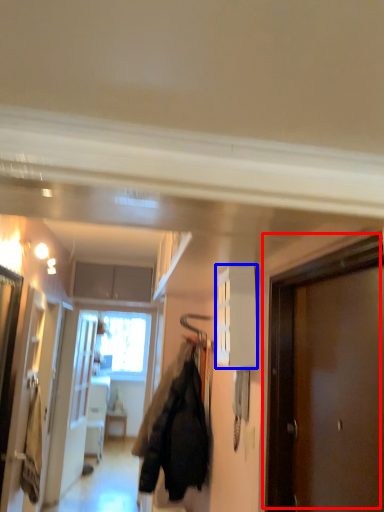
Question: Among these objects, which one is farthest to the camera, door (highlighted by a red box) or cabinetry (highlighted by a blue box)?

Choices:
 (A) door
 (B) cabinetry

Answer: (B)